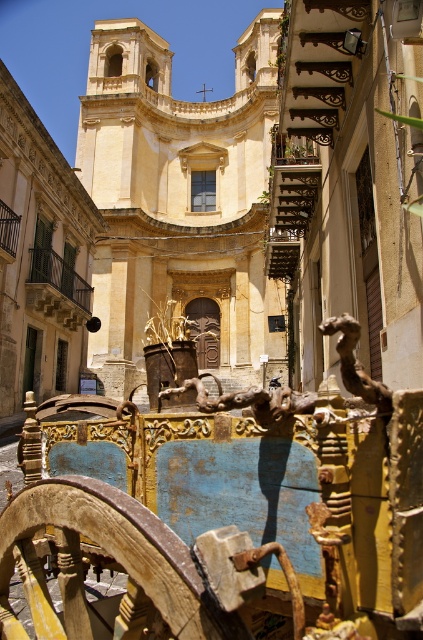
Question: Can you confirm if rusty wood cart at center is wider than yellow stone church at center?

Choices:
 (A) no
 (B) yes

Answer: (A)

Question: Which point is closer to the camera?

Choices:
 (A) rusty wood cart at center
 (B) yellow stone church at center

Answer: (A)

Question: Which point is farther to the camera?

Choices:
 (A) pyautogui.click(x=107, y=509)
 (B) pyautogui.click(x=269, y=51)

Answer: (B)

Question: Is the position of rusty wood cart at center less distant than that of yellow stone church at center?

Choices:
 (A) yes
 (B) no

Answer: (A)

Question: Does rusty wood cart at center have a greater width compared to yellow stone church at center?

Choices:
 (A) no
 (B) yes

Answer: (A)